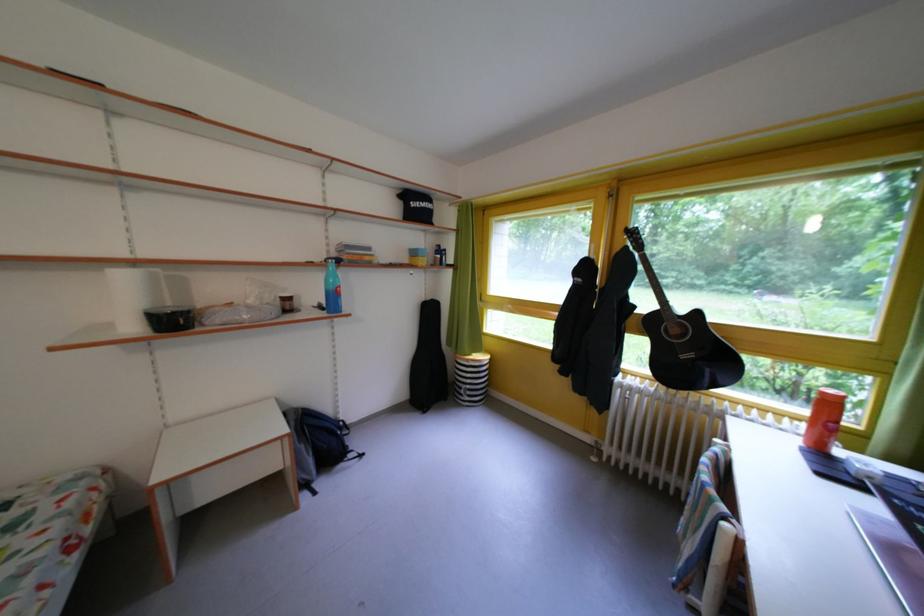
Locate an element on the screen. The height and width of the screenshot is (616, 924). paper towel roll is located at coordinates (134, 296).